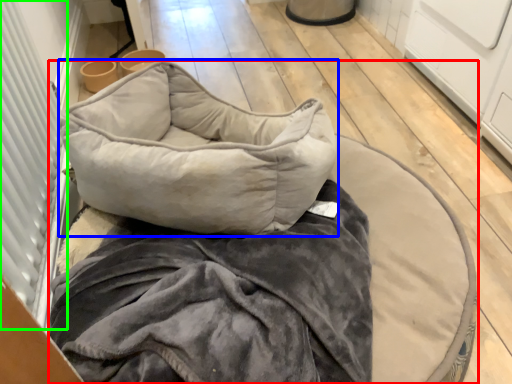
Question: Considering the real-world distances, which object is closest to furniture (highlighted by a red box)? pillow (highlighted by a blue box) or screen door (highlighted by a green box).

Choices:
 (A) pillow
 (B) screen door

Answer: (A)